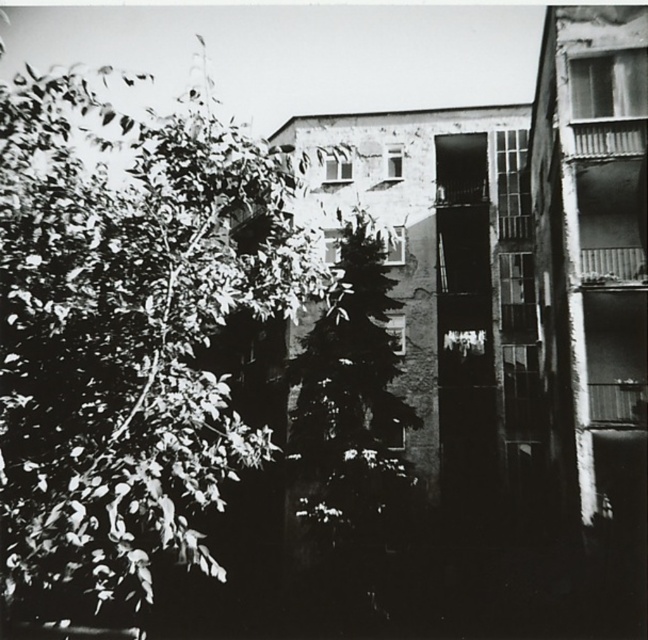
You are standing in the urban scene shown. You want to find the green leafy tree at left. Where should you look relative to the point marked at coordinates point [128,332]?

The green leafy tree at left is located at the point marked at coordinates point [128,332].

You are a photographer trying to capture the building in the background. You notice the green leafy tree at left and the dark green textured tree at center are blocking your view. Which tree should you move closer to in order to minimize obstruction?

The dark green textured tree at center is smaller in size compared to the green leafy tree at left, so moving closer to the dark green textured tree at center would result in less obstruction when photographing the building in the background.